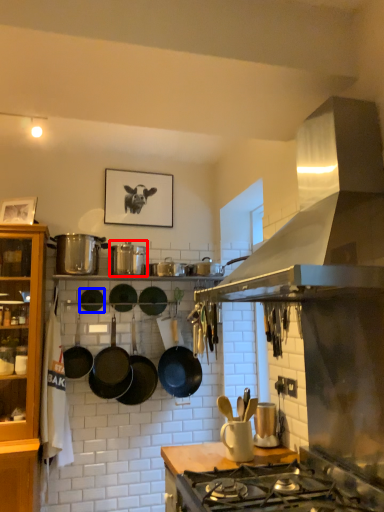
Question: Among these objects, which one is farthest to the camera, appliance (highlighted by a red box) or wok (highlighted by a blue box)?

Choices:
 (A) appliance
 (B) wok

Answer: (B)